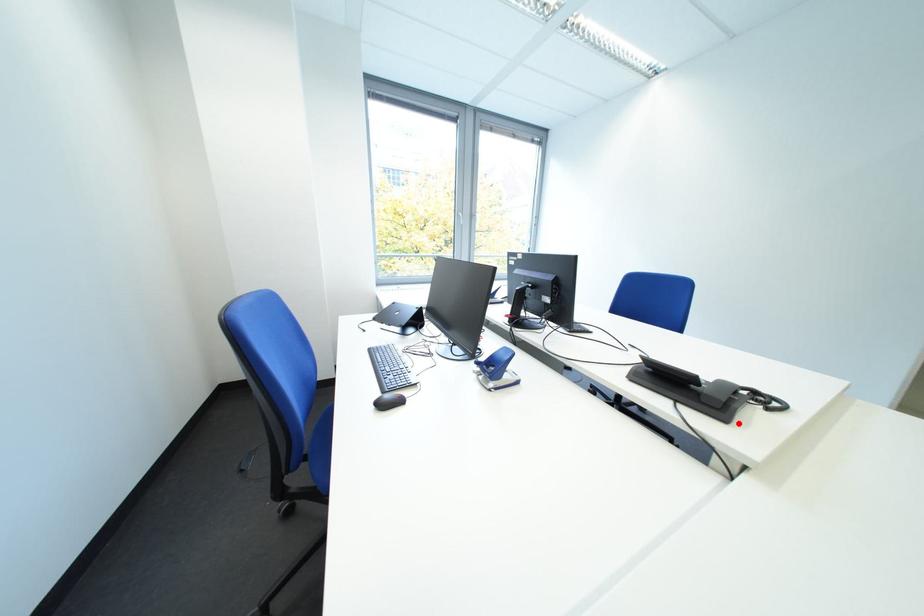
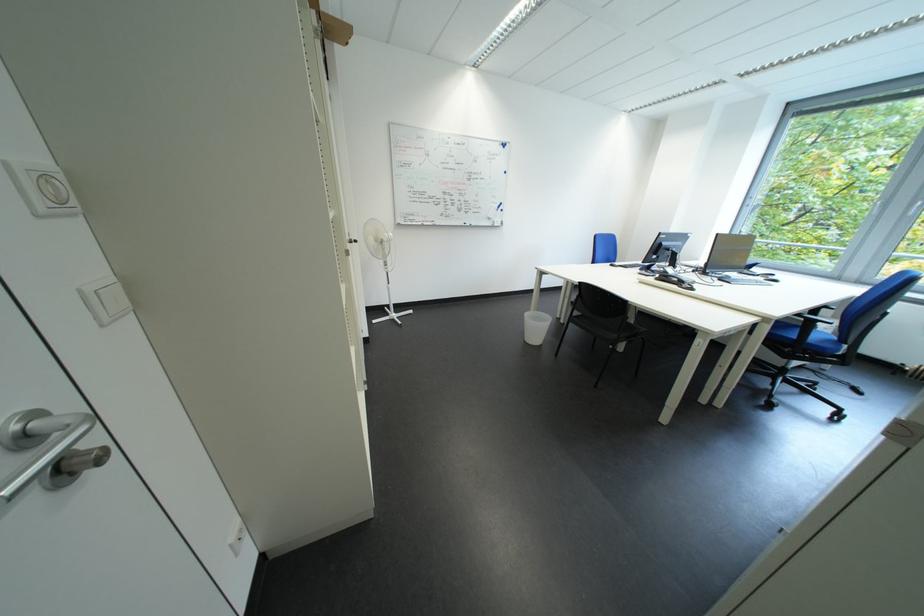
Question: I am providing you with two images of the same scene from different viewpoints. Given a red point in image1, look at the same physical point in image2. Is it:

Choices:
 (A) Closer to the viewpoint
 (B) Farther from the viewpoint

Answer: (A)